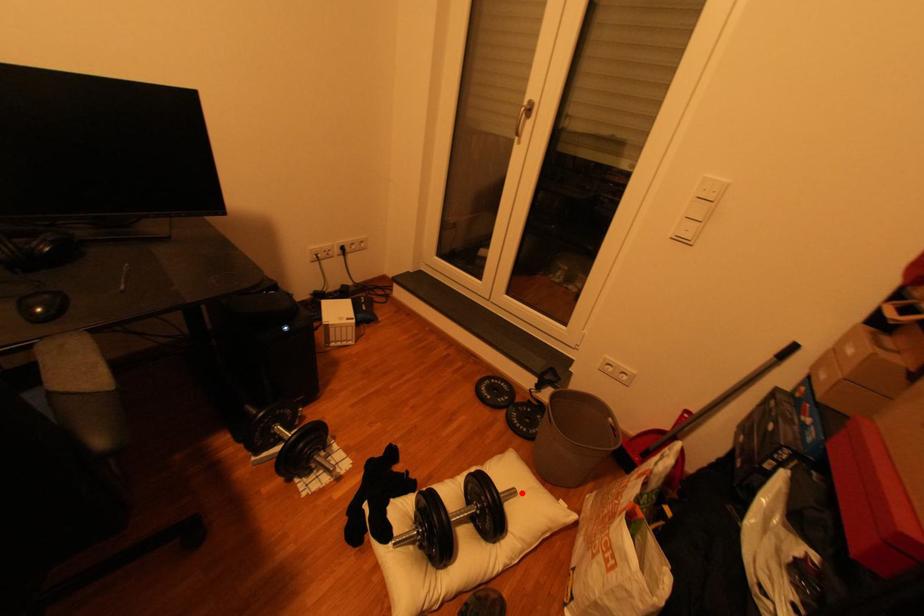
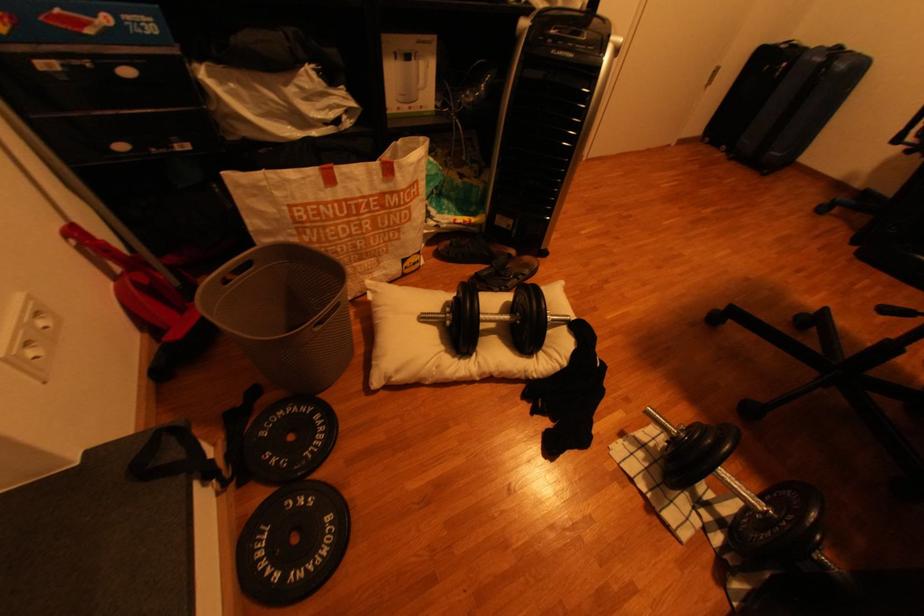
Question: I am providing you with two images of the same scene from different viewpoints. Image1 has a red point marked. In image2, the corresponding 3D location appears at what relative position? Reply with the corresponding letter.

Choices:
 (A) Closer
 (B) Farther

Answer: (B)